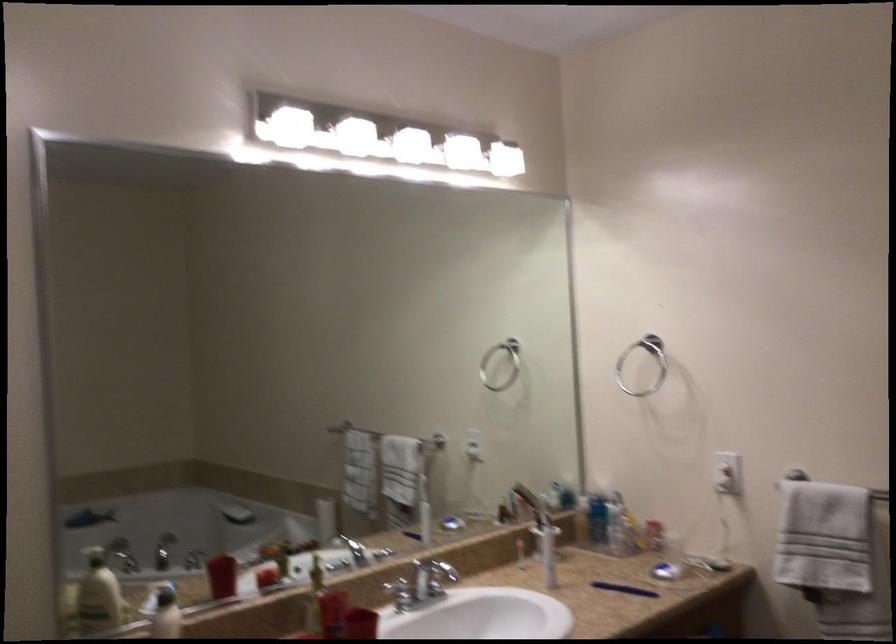
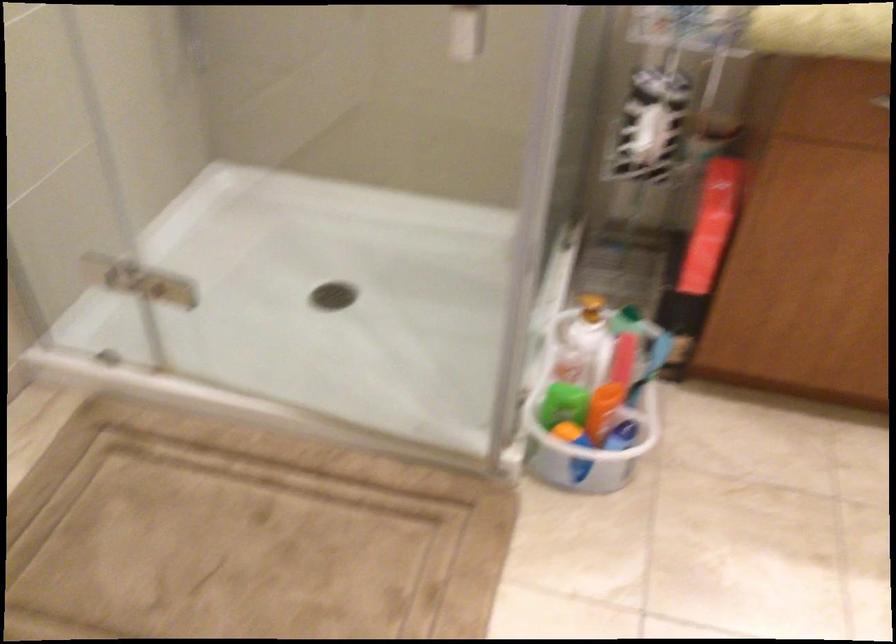
Consider the image. How did the camera likely rotate?

The camera rotated toward left-down.